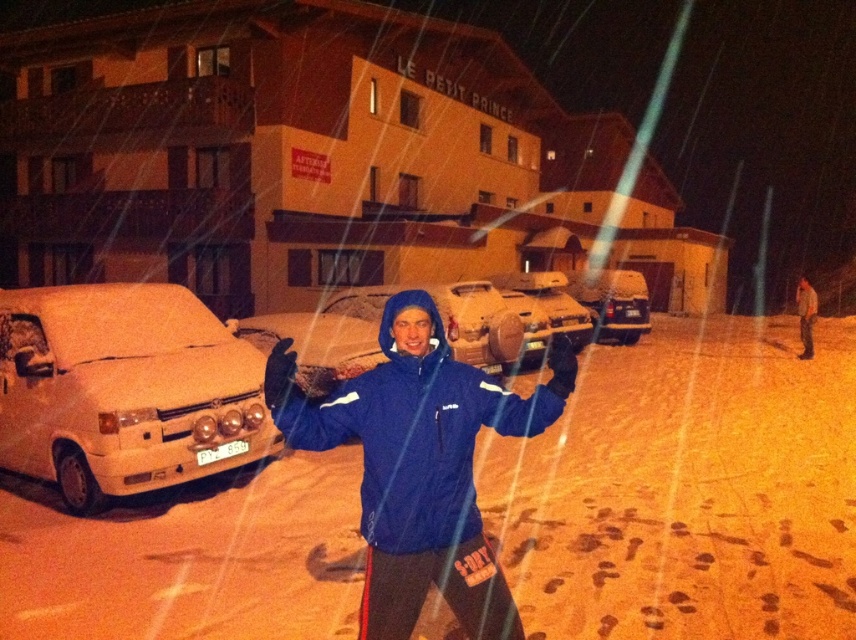
You are standing at the point marked by coordinates point (419, 465) in the snowy scene outside Le Petit Prince. What object is located exactly at that point?

The point (419, 465) marks the location of the blue matte jacket at center.